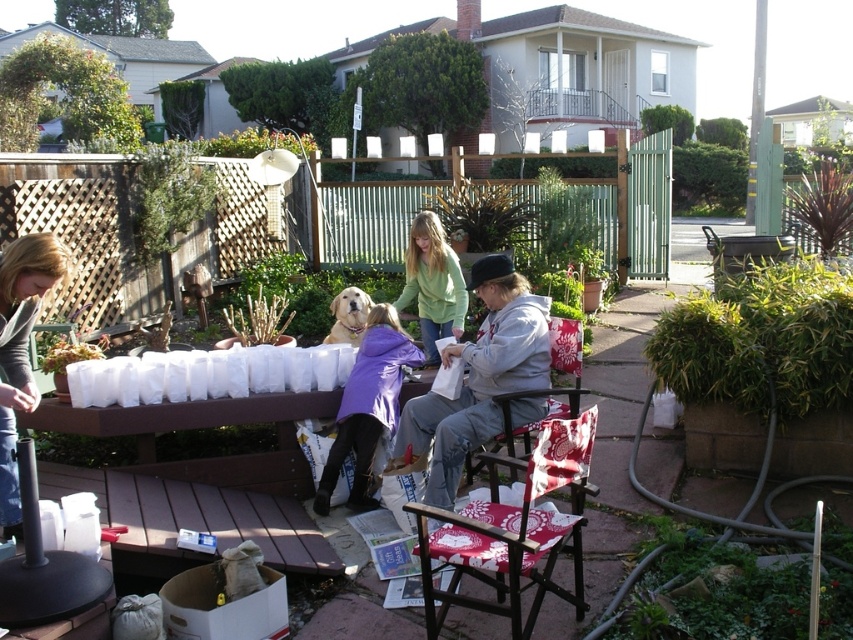
Does red floral fabric chair at center have a lesser width compared to matte gray shirt at left?

In fact, red floral fabric chair at center might be wider than matte gray shirt at left.

Identify the location of red floral fabric chair at center. (515, 532).

This screenshot has height=640, width=853. I want to click on red floral fabric chair at center, so click(515, 532).

In the scene shown: Is red floral fabric chair at center positioned in front of green fleece jacket at center?

Yes.

Does red floral fabric chair at center appear under green fleece jacket at center?

Indeed, red floral fabric chair at center is positioned under green fleece jacket at center.

You are a GUI agent. You are given a task and a screenshot of the screen. Output one action in this format:
    pyautogui.click(x=<x>, y=<y>)
    Task: Click on the red floral fabric chair at center
    
    Given the screenshot: What is the action you would take?
    pyautogui.click(x=515, y=532)

Where is `red floral fabric chair at center`? The image size is (853, 640). red floral fabric chair at center is located at coordinates 515,532.

Which of these two, gray fleece jacket at center or matte gray shirt at left, stands taller?

With more height is matte gray shirt at left.

Is point (459, 460) farther from camera compared to point (4, 422)?

That is True.

The width and height of the screenshot is (853, 640). In order to click on gray fleece jacket at center in this screenshot , I will do `click(477, 380)`.

Where is `gray fleece jacket at center`? gray fleece jacket at center is located at coordinates (477, 380).